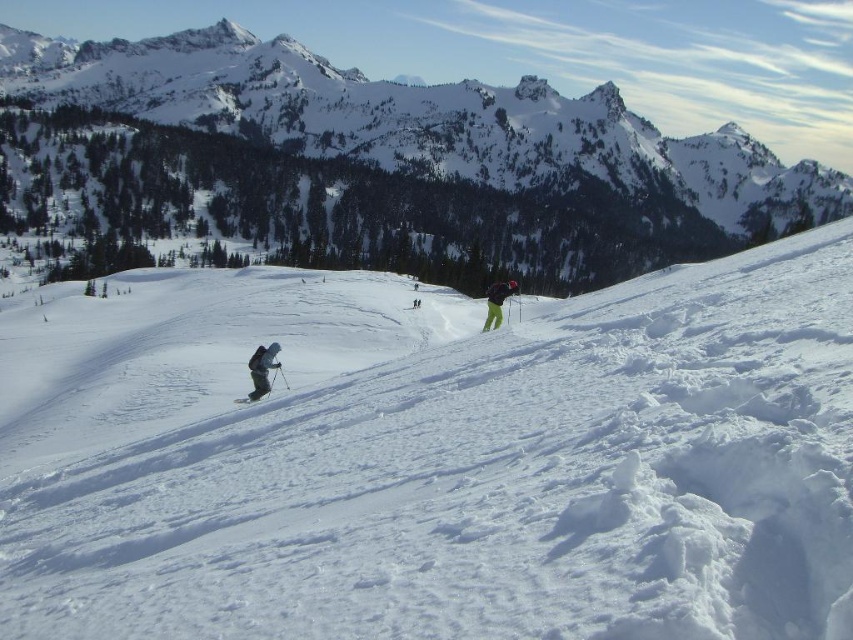
Does point (265, 372) come behind point (497, 326)?

That is False.

Does dark gray ski suit at lower left have a greater height compared to green matte pants at center?

In fact, dark gray ski suit at lower left may be shorter than green matte pants at center.

Does point (254, 355) lie behind point (508, 285)?

That is False.

In order to click on dark gray ski suit at lower left in this screenshot , I will do `click(262, 369)`.

Which is above, snowy mountain at upper center or white matte ski at lower left?

snowy mountain at upper center is higher up.

Between point (759, 188) and point (267, 388), which one is positioned behind?

Positioned behind is point (759, 188).

The image size is (853, 640). In order to click on snowy mountain at upper center in this screenshot , I will do `click(425, 160)`.

Is point (659, 371) farther from viewer compared to point (346, 252)?

That is False.

Is point (77, 374) more distant than point (630, 244)?

No, (77, 374) is in front of (630, 244).

Locate an element on the screen. white powdery snow at center is located at coordinates (433, 458).